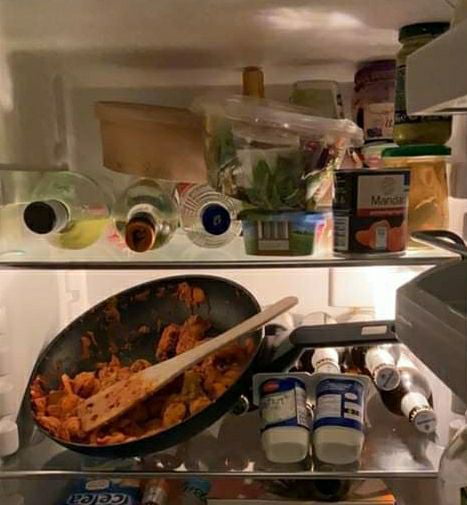
At what (x,y) coordinates should I click in order to perform the action: click on refrigerator. Please return your answer as a coordinate pair (x, y). The height and width of the screenshot is (505, 467). Looking at the image, I should click on (58, 100).